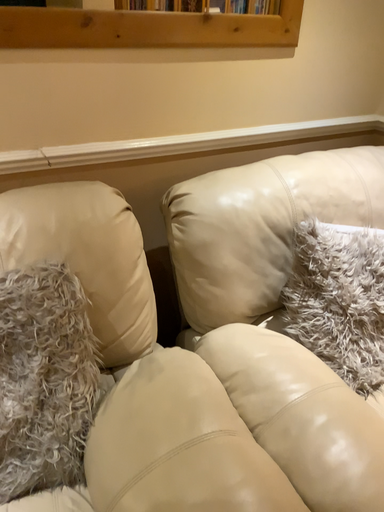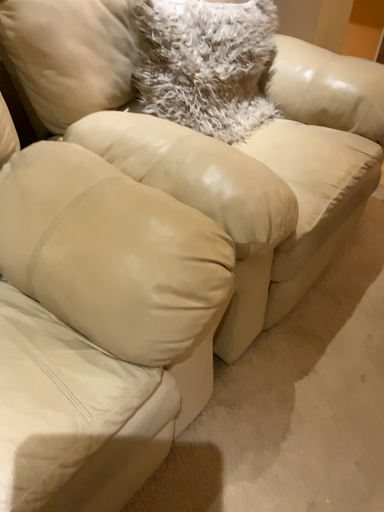
Question: How did the camera likely rotate when shooting the video?

Choices:
 (A) rotated upward
 (B) rotated downward

Answer: (B)